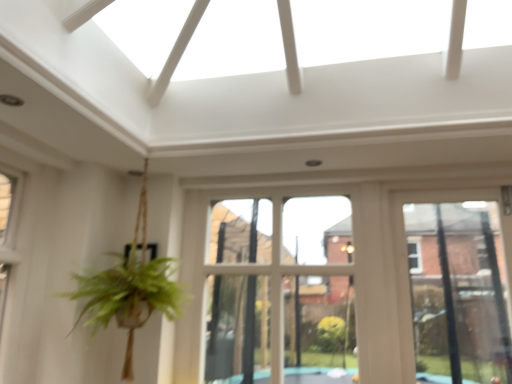
Describe the element at coordinates (280, 291) in the screenshot. This screenshot has width=512, height=384. I see `white wood bay window at center` at that location.

This screenshot has height=384, width=512. I want to click on white wood bay window at center, so (x=280, y=291).

Describe the element at coordinates (458, 293) in the screenshot. I see `clear glass window at center` at that location.

Identify the location of clear glass window at center. This screenshot has height=384, width=512. (458, 293).

Image resolution: width=512 pixels, height=384 pixels. In order to click on white wood bay window at center in this screenshot , I will do `click(280, 291)`.

Considering the positions of objects clear glass window at center and white wood bay window at center in the image provided, who is more to the left, clear glass window at center or white wood bay window at center?

white wood bay window at center.

Is clear glass window at center closer to the viewer compared to white wood bay window at center?

No, clear glass window at center is further to the viewer.

Which is closer, (463, 271) or (324, 366)?

Point (463, 271)

From the image's perspective, which is below, clear glass window at center or white wood bay window at center?

clear glass window at center, from the image's perspective.

From a real-world perspective, is clear glass window at center physically below white wood bay window at center?

Yes.

Is clear glass window at center thinner than white wood bay window at center?

Correct, the width of clear glass window at center is less than that of white wood bay window at center.

Is clear glass window at center shorter than white wood bay window at center?

Yes, clear glass window at center is shorter than white wood bay window at center.

In the scene shown: Between clear glass window at center and white wood bay window at center, which one has smaller size?

clear glass window at center is smaller.

Does clear glass window at center contain white wood bay window at center?

No, white wood bay window at center is not surrounded by clear glass window at center.

Is clear glass window at center positioned far away from white wood bay window at center?

clear glass window at center is actually quite close to white wood bay window at center.

Is clear glass window at center looking in the opposite direction of white wood bay window at center?

No, clear glass window at center is not facing the opposite direction of white wood bay window at center.

How different are the orientations of clear glass window at center and white wood bay window at center in degrees?

0.264 degrees.

Measure the distance from clear glass window at center to white wood bay window at center.

A distance of 27.41 inches exists between clear glass window at center and white wood bay window at center.

Where is `bay window that appears above the clear glass window at center (from the image's perspective)`? This screenshot has height=384, width=512. bay window that appears above the clear glass window at center (from the image's perspective) is located at coordinates (280, 291).

Considering the relative positions of white wood bay window at center and clear glass window at center in the image provided, is white wood bay window at center to the right of clear glass window at center from the viewer's perspective?

Incorrect, white wood bay window at center is not on the right side of clear glass window at center.

Is white wood bay window at center in front of or behind clear glass window at center in the image?

In the image, white wood bay window at center appears in front of clear glass window at center.

Considering the points (241, 215) and (461, 374), which point is behind, point (241, 215) or point (461, 374)?

Point (241, 215)

From the image's perspective, is white wood bay window at center located beneath clear glass window at center?

No, from the image's perspective, white wood bay window at center is not below clear glass window at center.

From a real-world perspective, is white wood bay window at center physically located above or below clear glass window at center?

white wood bay window at center is situated higher than clear glass window at center in the real world.

Considering the relative sizes of white wood bay window at center and clear glass window at center in the image provided, is white wood bay window at center thinner than clear glass window at center?

No, white wood bay window at center is not thinner than clear glass window at center.

Is white wood bay window at center taller than clear glass window at center?

Yes, white wood bay window at center is taller than clear glass window at center.

Based on the photo, does white wood bay window at center have a smaller size compared to clear glass window at center?

Actually, white wood bay window at center might be larger than clear glass window at center.

Would you say white wood bay window at center is inside or outside clear glass window at center?

white wood bay window at center is not enclosed by clear glass window at center.

Is there a large distance between white wood bay window at center and clear glass window at center?

white wood bay window at center is near clear glass window at center, not far away.

Is white wood bay window at center oriented towards clear glass window at center?

No, white wood bay window at center does not turn towards clear glass window at center.

This screenshot has width=512, height=384. I want to click on window frame that is under the white wood bay window at center (from a real-world perspective), so click(x=458, y=293).

Locate an element on the screen. Image resolution: width=512 pixels, height=384 pixels. bay window located above the clear glass window at center (from the image's perspective) is located at coordinates (280, 291).

Image resolution: width=512 pixels, height=384 pixels. Find the location of `window frame behind the white wood bay window at center`. window frame behind the white wood bay window at center is located at coordinates (458, 293).